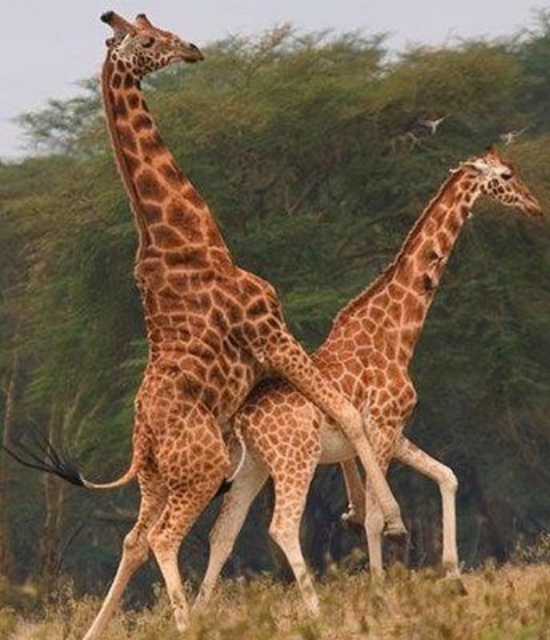
Is brown spotted giraffe at center below green grass at lower center?

No, brown spotted giraffe at center is not below green grass at lower center.

Who is more forward, (389, 340) or (442, 618)?

Positioned in front is point (442, 618).

Locate an element on the screen. The width and height of the screenshot is (550, 640). brown spotted giraffe at center is located at coordinates (411, 323).

Locate an element on the screen. Image resolution: width=550 pixels, height=640 pixels. brown spotted giraffe at center is located at coordinates (411, 323).

Who is higher up, spotted fur giraffe at center or brown spotted giraffe at center?

spotted fur giraffe at center

Does spotted fur giraffe at center come in front of brown spotted giraffe at center?

Yes, spotted fur giraffe at center is in front of brown spotted giraffe at center.

Is point (138, 209) in front of point (370, 394)?

Yes, it is.

You are a GUI agent. You are given a task and a screenshot of the screen. Output one action in this format:
    pyautogui.click(x=<x>, y=<y>)
    Task: Click on the spotted fur giraffe at center
    This screenshot has width=550, height=640.
    Given the screenshot: What is the action you would take?
    pyautogui.click(x=189, y=332)

Is point (210, 280) more distant than point (107, 636)?

No.

Who is more forward, [135,438] or [327,586]?

Positioned in front is point [135,438].

Which is behind, point (156, 68) or point (363, 605)?

Positioned behind is point (156, 68).

Locate an element on the screen. This screenshot has width=550, height=640. spotted fur giraffe at center is located at coordinates (189, 332).